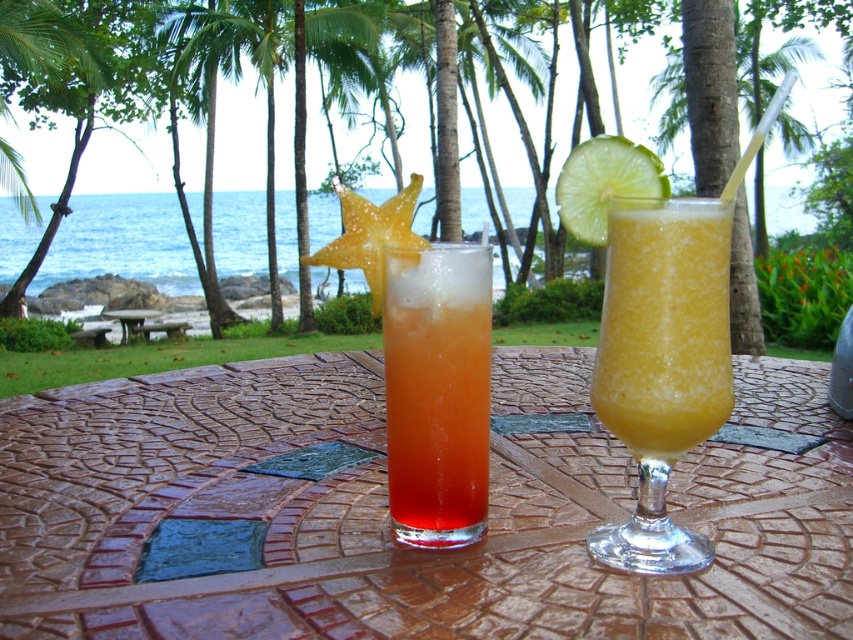
You are holding a small drone that can fly up to 10 inches away from you. You want to fly it to a specific point marked at coordinates point (422,413). Will your drone be able to reach that point?

The distance of point (422,413) from viewer is 12.56 inches, which exceeds the drone maximum range of 10 inches. The drone cannot reach that point.

You are holding a small drone that has a maximum flight range of 10 inches. You want to fly it from your current position to the point at coordinates point (560, 205). Can your drone reach that point?

The distance between point (560, 205) and the camera is 12.43 inches. Since the drone can only fly up to 10 inches, it cannot reach the point.

You are a waiter carrying a tray of drinks and need to place a new drink between the green matte lime at upper right and the brown textured table at center. Given that the tray is 3 feet wide, will there be enough space to place the tray between them?

The distance between the green matte lime at upper right and the brown textured table at center is 15.91 feet. Since the tray is only 3 feet wide, there is more than enough space to place the tray between them.